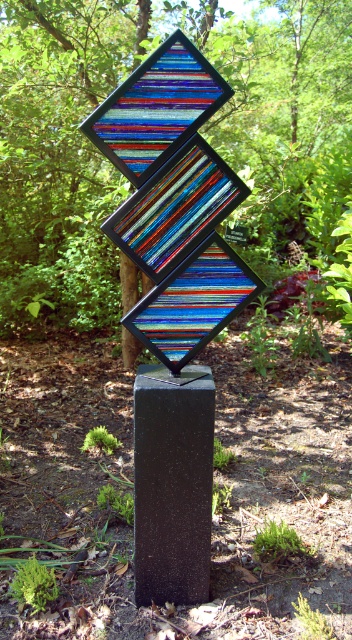
You are an artist planning to paint this scene. You need to know which object, the green leafy tree at center or the black polished stone at center, has a greater width to decide where to focus your brushstrokes. Which one is wider?

The green leafy tree at center is wider than the black polished stone at center, so you should focus more brushstrokes on the wider area of the green leafy tree at center.